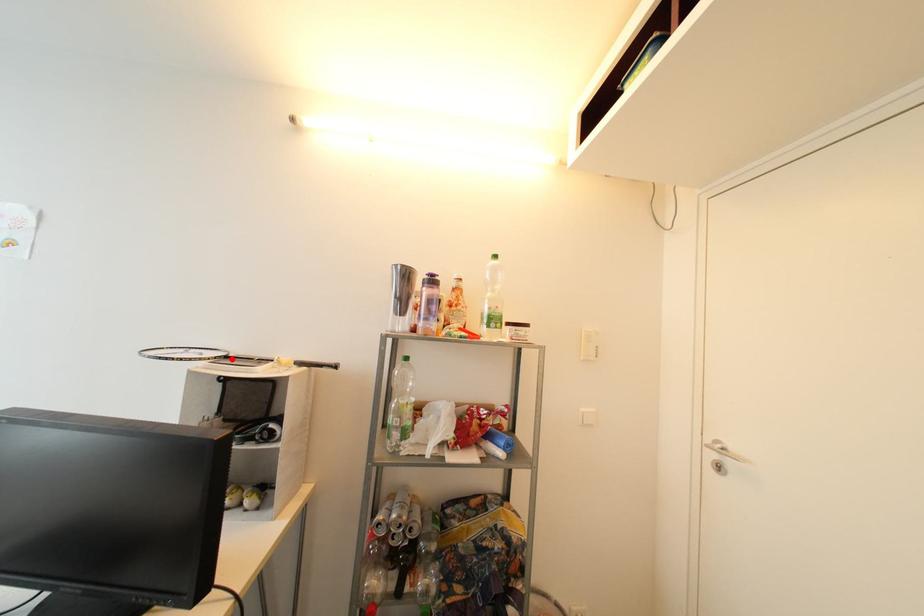
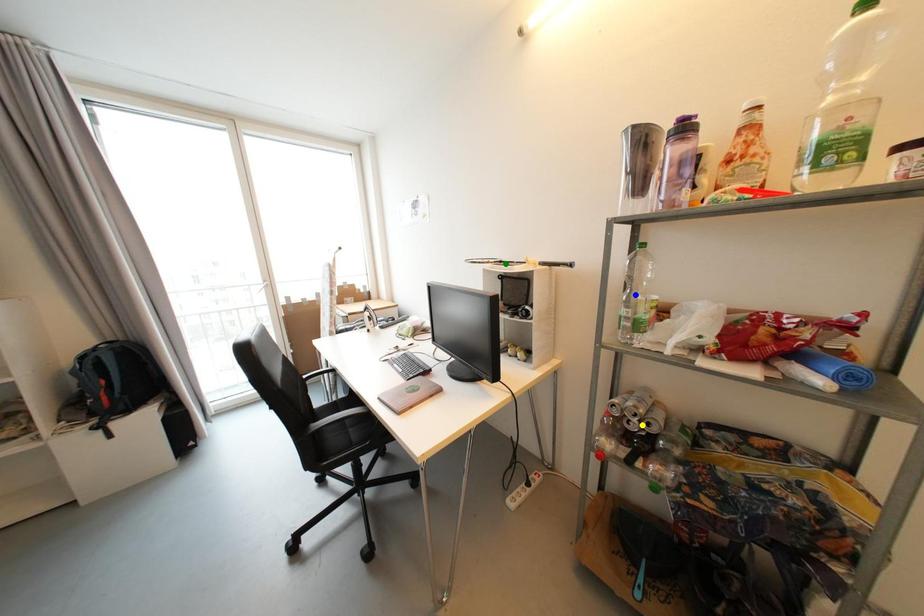
Question: I am providing you with two images of the same scene from different viewpoints. A red point is marked on the first image. You are given multiple points on the second image. Which mark in image 2 goes with the point in image 1?

Choices:
 (A) blue point
 (B) yellow point
 (C) green point

Answer: (C)